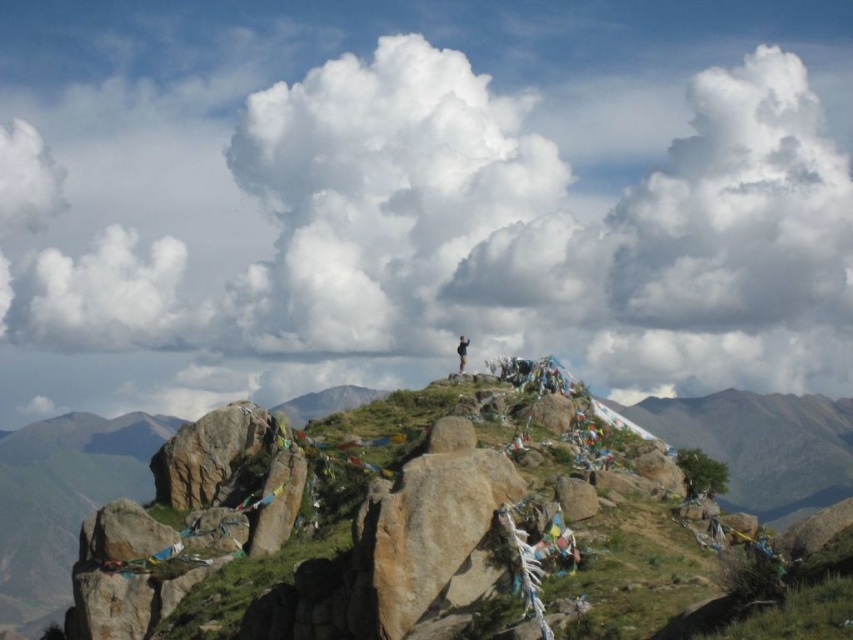
You are hiking in the mountainous area and want to place your backpack between the rusty rock at center and the smooth brown rock at center. Which rock should you place it closer to if you want it to be more visible to someone approaching from the front?

You should place your backpack closer to the rusty rock at center because it is closer to the viewer than the smooth brown rock at center, making it more visible to someone approaching from the front.

You are a hiker trying to take a photo of the black fabric person at center. However, there is a rusty rock at center blocking your view. Can you adjust your position to capture the person without the rock in the frame?

The rusty rock at center is in front of the black fabric person at center, so moving slightly to the side or adjusting your angle might allow you to capture the person without the rock obstructing the view.

From the picture: You are a hiker standing at the base of the mountain. You see the smooth brown rock at center in the distance. If your GPS says you need to reach it within 100 meters of your current position, will you be able to reach it in time?

The smooth brown rock at center is 67.51 meters away from the viewer, which is within the 100 meters required by the GPS. Therefore, you can reach it in time.